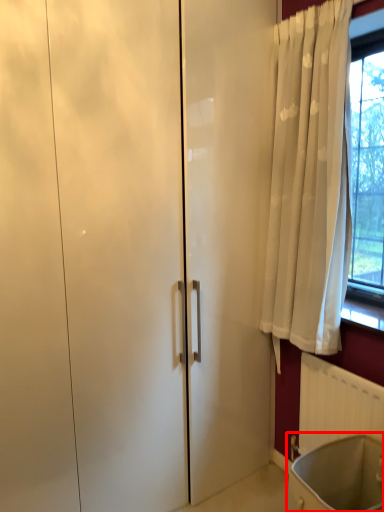
Question: From the image's perspective, what is the correct spatial positioning of bath (annotated by the red box) in reference to radiator?

Choices:
 (A) below
 (B) above

Answer: (A)